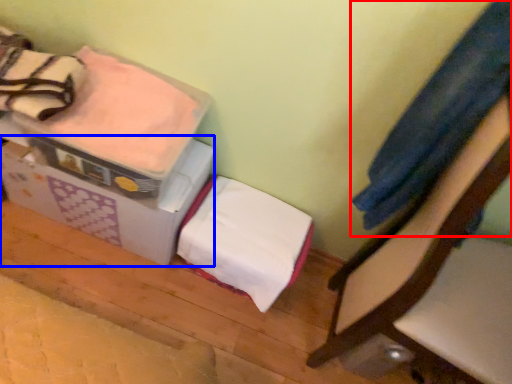
Question: Which of the following is the closest to the observer, clothing (highlighted by a red box) or cardboard box (highlighted by a blue box)?

Choices:
 (A) clothing
 (B) cardboard box

Answer: (A)